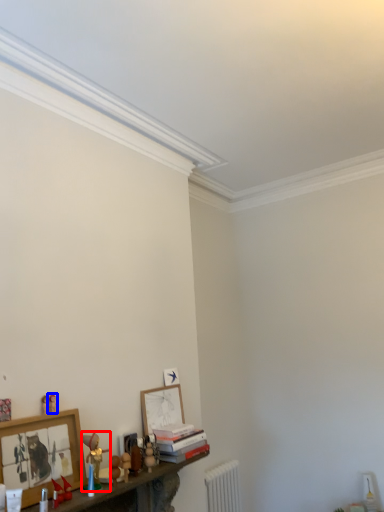
Question: Among these objects, which one is nearest to the camera, toy (highlighted by a red box) or toy (highlighted by a blue box)?

Choices:
 (A) toy
 (B) toy

Answer: (A)